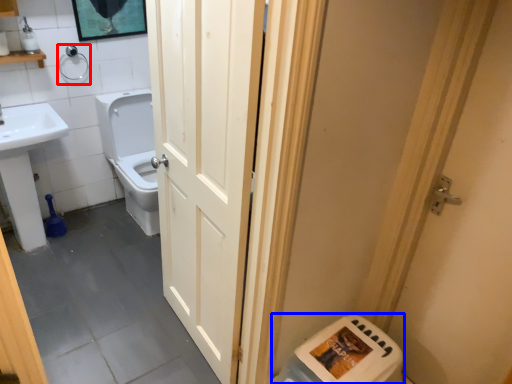
Question: Among these objects, which one is nearest to the camera, towel bar (highlighted by a red box) or water heater (highlighted by a blue box)?

Choices:
 (A) towel bar
 (B) water heater

Answer: (B)